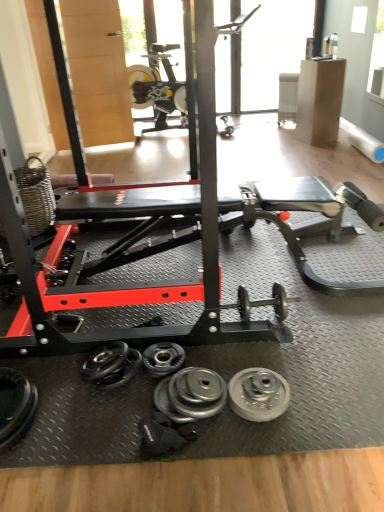
Locate an element on the screen. The height and width of the screenshot is (512, 384). free space in front of silver metallic weight at center, marked as the second wheel in a right-to-left arrangement is located at coordinates (189, 461).